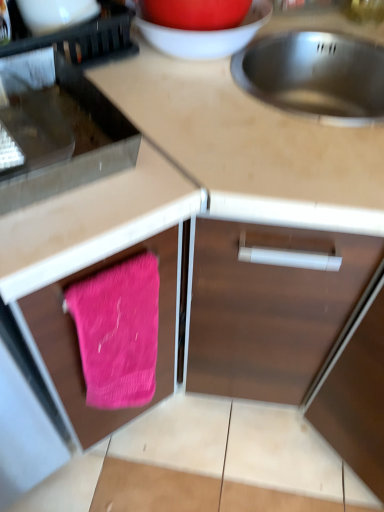
Question: Considering the relative sizes of pink fabric at lower left and black plastic dish rack at upper left, which is counted as the 1th appliance, starting from the left, in the image provided, is pink fabric at lower left thinner than black plastic dish rack at upper left, which is counted as the 1th appliance, starting from the left,?

Choices:
 (A) yes
 (B) no

Answer: (B)

Question: Is pink fabric at lower left facing away from black plastic dish rack at upper left, marked as the third appliance in a right-to-left arrangement?

Choices:
 (A) no
 (B) yes

Answer: (A)

Question: Considering the relative sizes of pink fabric at lower left and black plastic dish rack at upper left, marked as the third appliance in a right-to-left arrangement, in the image provided, is pink fabric at lower left shorter than black plastic dish rack at upper left, marked as the third appliance in a right-to-left arrangement,?

Choices:
 (A) yes
 (B) no

Answer: (B)

Question: Can you confirm if pink fabric at lower left is bigger than black plastic dish rack at upper left, arranged as the first appliance when viewed from the top?

Choices:
 (A) yes
 (B) no

Answer: (A)

Question: Is pink fabric at lower left smaller than black plastic dish rack at upper left, which ranks as the 3th appliance in bottom-to-top order?

Choices:
 (A) no
 (B) yes

Answer: (A)

Question: Is pink fabric at lower left at the right side of black plastic dish rack at upper left, arranged as the first appliance when viewed from the top?

Choices:
 (A) yes
 (B) no

Answer: (A)

Question: From a real-world perspective, does matte white bowl at upper center stand above metallic stainless steel oven at left, arranged as the 2th appliance when viewed from the left?

Choices:
 (A) yes
 (B) no

Answer: (A)

Question: Considering the relative sizes of matte white bowl at upper center and metallic stainless steel oven at left, arranged as the 2th appliance when viewed from the left, in the image provided, is matte white bowl at upper center thinner than metallic stainless steel oven at left, arranged as the 2th appliance when viewed from the left,?

Choices:
 (A) yes
 (B) no

Answer: (A)

Question: Can you confirm if matte white bowl at upper center is bigger than metallic stainless steel oven at left, the second appliance in the right-to-left sequence?

Choices:
 (A) no
 (B) yes

Answer: (A)

Question: Does matte white bowl at upper center appear on the right side of metallic stainless steel oven at left, the second appliance in the right-to-left sequence?

Choices:
 (A) no
 (B) yes

Answer: (B)

Question: Can you confirm if matte white bowl at upper center is positioned to the left of metallic stainless steel oven at left, positioned as the second appliance in top-to-bottom order?

Choices:
 (A) yes
 (B) no

Answer: (B)

Question: From the image's perspective, is matte white bowl at upper center beneath metallic stainless steel oven at left, arranged as the 2th appliance when viewed from the left?

Choices:
 (A) yes
 (B) no

Answer: (B)

Question: Is pink knitted towel at lower left further to camera compared to metallic stainless steel sink at upper right?

Choices:
 (A) no
 (B) yes

Answer: (A)